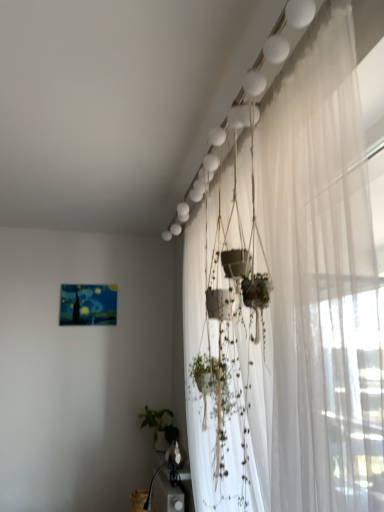
Question: From the image's perspective, relative to green matte plant at lower center, is white sheer curtain at upper right above or below?

Choices:
 (A) above
 (B) below

Answer: (A)

Question: Considering the positions of white sheer curtain at upper right and green matte plant at lower center in the image, is white sheer curtain at upper right taller or shorter than green matte plant at lower center?

Choices:
 (A) short
 (B) tall

Answer: (B)

Question: Considering the positions of point [342, 221] and point [168, 429], is point [342, 221] closer or farther from the camera than point [168, 429]?

Choices:
 (A) closer
 (B) farther

Answer: (A)

Question: Considering their positions, is green matte plant at lower center located in front of or behind white sheer curtain at upper right?

Choices:
 (A) front
 (B) behind

Answer: (B)

Question: Based on their sizes in the image, would you say green matte plant at lower center is bigger or smaller than white sheer curtain at upper right?

Choices:
 (A) small
 (B) big

Answer: (A)

Question: Does point tap(170, 437) appear closer or farther from the camera than point tap(340, 330)?

Choices:
 (A) closer
 (B) farther

Answer: (B)

Question: Choose the correct answer: Is green matte plant at lower center inside white sheer curtain at upper right or outside it?

Choices:
 (A) outside
 (B) inside

Answer: (A)